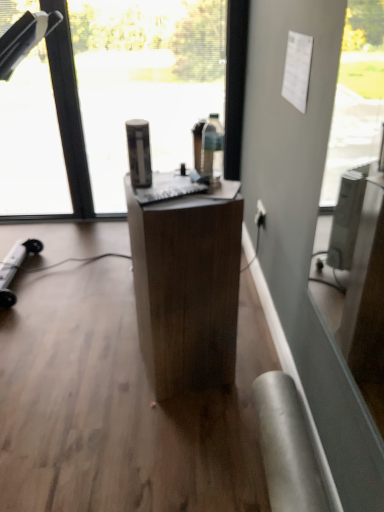
Find the location of `blank space to the left of wooden desk at center`. blank space to the left of wooden desk at center is located at coordinates (107, 372).